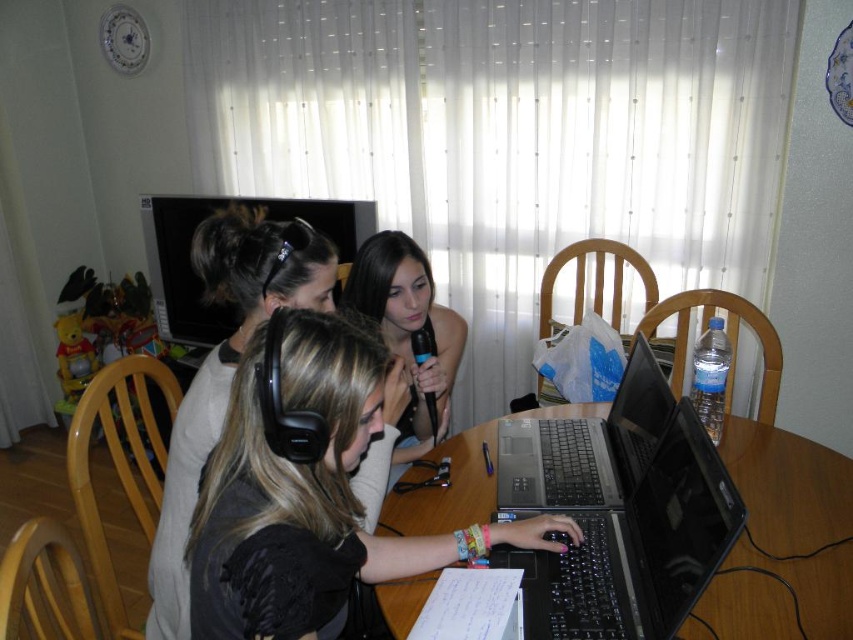
Question: Is black matte headphones at center above black plastic table at center?

Choices:
 (A) yes
 (B) no

Answer: (A)

Question: Does black plastic table at center have a larger size compared to smooth black microphone at center?

Choices:
 (A) yes
 (B) no

Answer: (B)

Question: Which point appears farthest from the camera in this image?

Choices:
 (A) (421, 264)
 (B) (631, 422)
 (C) (816, 472)

Answer: (A)

Question: Is black matte headphones at center wider than black plastic laptop at center?

Choices:
 (A) yes
 (B) no

Answer: (A)

Question: Which point is closer to the camera taking this photo?

Choices:
 (A) (821, 620)
 (B) (440, 406)
 (C) (567, 529)
 (D) (659, 378)

Answer: (A)

Question: Considering the real-world distances, which object is closest to the black plastic laptop at center?

Choices:
 (A) black plastic table at center
 (B) black matte headphones at center

Answer: (A)